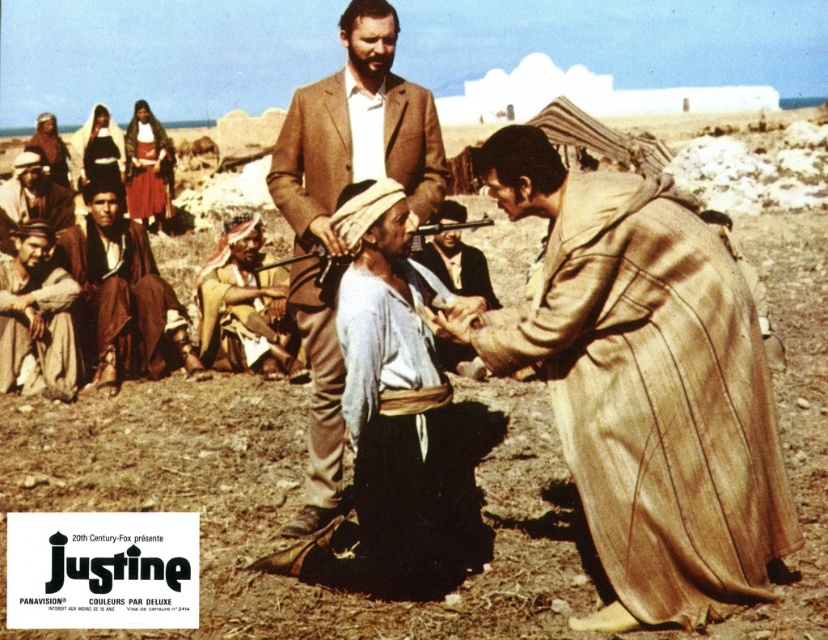
You are an observer analyzing the coordinates of objects in the image. The point at the bottom left corner of the image has coordinates approximately (36, 317). What object is located at this coordinate?

The point at coordinates (36, 317) corresponds to the brown leather robe at lower left.

From the picture: Based on the scene described, which object is located lower in the image, the beige woolen robe at lower right or the yellow fabric headscarf at center?

The beige woolen robe at lower right is positioned under the yellow fabric headscarf at center, so it is located lower in the image.

You are a character in the film Justine, standing at a specific location in the desert scene. You notice a point marked at coordinates (643, 385). Can you identify which object this point corresponds to?

The point at (643, 385) is located on the beige woolen robe at lower right.